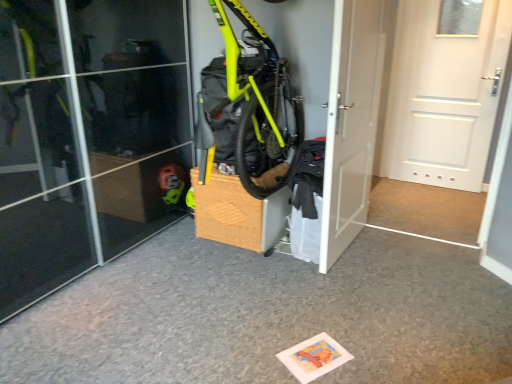
Locate an element on the screen. white matte door at center, arranged as the 2th door when viewed from the right is located at coordinates (351, 122).

Describe the element at coordinates (351, 122) in the screenshot. The height and width of the screenshot is (384, 512). I see `white matte door at center, the first door when ordered from left to right` at that location.

Measure the distance between white matte door at center, arranged as the 2th door when viewed from the right, and camera.

white matte door at center, arranged as the 2th door when viewed from the right, and camera are 2.10 meters apart from each other.

This screenshot has width=512, height=384. Describe the element at coordinates (443, 96) in the screenshot. I see `white matte door at right, the 1th door when ordered from right to left` at that location.

Locate an element on the screen. The width and height of the screenshot is (512, 384). white matte door at right, the 1th door when ordered from right to left is located at coordinates (443, 96).

At what (x,y) coordinates should I click in order to perform the action: click on white matte door at center, the first door when ordered from left to right. Please return your answer as a coordinate pair (x, y). Looking at the image, I should click on (351, 122).

Considering the relative positions of white matte door at center, arranged as the 2th door when viewed from the right, and white matte door at right, which is the second door from left to right, in the image provided, is white matte door at center, arranged as the 2th door when viewed from the right, to the right of white matte door at right, which is the second door from left to right, from the viewer's perspective?

In fact, white matte door at center, arranged as the 2th door when viewed from the right, is to the left of white matte door at right, which is the second door from left to right.

Relative to white matte door at right, which is the second door from left to right, is white matte door at center, arranged as the 2th door when viewed from the right, in front or behind?

white matte door at center, arranged as the 2th door when viewed from the right, is in front of white matte door at right, which is the second door from left to right.

Considering the points (370, 41) and (436, 67), which point is behind, point (370, 41) or point (436, 67)?

The point (436, 67) is farther.

From the image's perspective, is white matte door at center, the first door when ordered from left to right, above white matte door at right, the 1th door when ordered from right to left?

No, from the image's perspective, white matte door at center, the first door when ordered from left to right, is not above white matte door at right, the 1th door when ordered from right to left.

From a real-world perspective, which object stands above the other?

white matte door at right, which is the second door from left to right.

In terms of width, does white matte door at center, the first door when ordered from left to right, look wider or thinner when compared to white matte door at right, the 1th door when ordered from right to left?

In the image, white matte door at center, the first door when ordered from left to right, appears to be more narrow than white matte door at right, the 1th door when ordered from right to left.

Is white matte door at center, arranged as the 2th door when viewed from the right, taller than white matte door at right, the 1th door when ordered from right to left?

Indeed, white matte door at center, arranged as the 2th door when viewed from the right, has a greater height compared to white matte door at right, the 1th door when ordered from right to left.

Is white matte door at center, arranged as the 2th door when viewed from the right, smaller than white matte door at right, which is the second door from left to right?

Indeed, white matte door at center, arranged as the 2th door when viewed from the right, has a smaller size compared to white matte door at right, which is the second door from left to right.

Would you say white matte door at right, the 1th door when ordered from right to left, is part of white matte door at center, arranged as the 2th door when viewed from the right,'s contents?

No, white matte door at right, the 1th door when ordered from right to left, is not surrounded by white matte door at center, arranged as the 2th door when viewed from the right.

Is white matte door at center, arranged as the 2th door when viewed from the right, not near white matte door at right, which is the second door from left to right?

Absolutely, white matte door at center, arranged as the 2th door when viewed from the right, is distant from white matte door at right, which is the second door from left to right.

Could you tell me if white matte door at center, the first door when ordered from left to right, is turned towards white matte door at right, which is the second door from left to right?

Yes, white matte door at center, the first door when ordered from left to right, is turned towards white matte door at right, which is the second door from left to right.

How much distance is there between white matte door at center, the first door when ordered from left to right, and white matte door at right, the 1th door when ordered from right to left?

white matte door at center, the first door when ordered from left to right, is 1.36 meters from white matte door at right, the 1th door when ordered from right to left.

This screenshot has width=512, height=384. I want to click on door below the white matte door at right, which is the second door from left to right (from a real-world perspective), so click(351, 122).

Considering the positions of objects white matte door at right, which is the second door from left to right, and white matte door at center, arranged as the 2th door when viewed from the right, in the image provided, who is more to the right, white matte door at right, which is the second door from left to right, or white matte door at center, arranged as the 2th door when viewed from the right,?

Positioned to the right is white matte door at right, which is the second door from left to right.

Based on the photo, relative to white matte door at center, arranged as the 2th door when viewed from the right, is white matte door at right, the 1th door when ordered from right to left, in front or behind?

white matte door at right, the 1th door when ordered from right to left, is positioned farther from the viewer than white matte door at center, arranged as the 2th door when viewed from the right.

Does point (461, 110) appear closer or farther from the camera than point (334, 166)?

Point (461, 110) is positioned farther from the camera compared to point (334, 166).

From the image's perspective, which is below, white matte door at right, the 1th door when ordered from right to left, or white matte door at center, arranged as the 2th door when viewed from the right?

white matte door at center, arranged as the 2th door when viewed from the right.

From the picture: From a real-world perspective, is white matte door at right, the 1th door when ordered from right to left, physically located above or below white matte door at center, arranged as the 2th door when viewed from the right?

Clearly, from a real-world perspective, white matte door at right, the 1th door when ordered from right to left, is above white matte door at center, arranged as the 2th door when viewed from the right.

Is white matte door at right, which is the second door from left to right, thinner than white matte door at center, arranged as the 2th door when viewed from the right?

No.

Between white matte door at right, the 1th door when ordered from right to left, and white matte door at center, the first door when ordered from left to right, which one has less height?

With less height is white matte door at right, the 1th door when ordered from right to left.

Does white matte door at right, the 1th door when ordered from right to left, have a smaller size compared to white matte door at center, the first door when ordered from left to right?

Incorrect, white matte door at right, the 1th door when ordered from right to left, is not smaller in size than white matte door at center, the first door when ordered from left to right.

Could white matte door at center, arranged as the 2th door when viewed from the right, be considered to be inside white matte door at right, which is the second door from left to right?

No, white matte door at center, arranged as the 2th door when viewed from the right, is not a part of white matte door at right, which is the second door from left to right.

Are white matte door at right, which is the second door from left to right, and white matte door at center, arranged as the 2th door when viewed from the right, making contact?

No, white matte door at right, which is the second door from left to right, is not with white matte door at center, arranged as the 2th door when viewed from the right.

In the scene shown: Is white matte door at right, the 1th door when ordered from right to left, facing away from white matte door at center, the first door when ordered from left to right?

white matte door at right, the 1th door when ordered from right to left, is not turned away from white matte door at center, the first door when ordered from left to right.

Where is `door located above the white matte door at center, the first door when ordered from left to right (from the image's perspective)`? This screenshot has height=384, width=512. door located above the white matte door at center, the first door when ordered from left to right (from the image's perspective) is located at coordinates (443, 96).

In the image, there is a white matte door at right, the 1th door when ordered from right to left. Find the location of `door below it (from the image's perspective)`. door below it (from the image's perspective) is located at coordinates (351, 122).

What are the coordinates of `door that is above the white matte door at center, the first door when ordered from left to right (from the image's perspective)` in the screenshot? It's located at (443, 96).